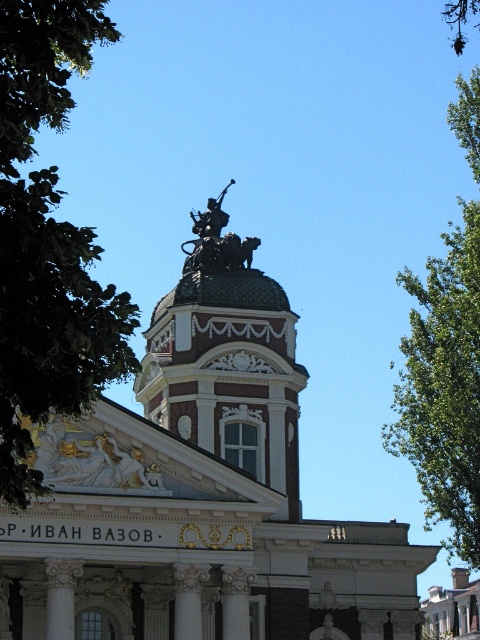
You are standing in front of the grand building with the dome and statue. You notice a point marked at coordinates (48,241). What does this point represent?

The point at (48,241) represents a green leafy tree at upper left.

You are an architect analyzing the symmetry of the building. The statue at the center is marked by point (227, 358). Is this point exactly at the center of the building?

The statue at the center is represented by point (227, 358), so yes, this point is exactly at the center of the building.